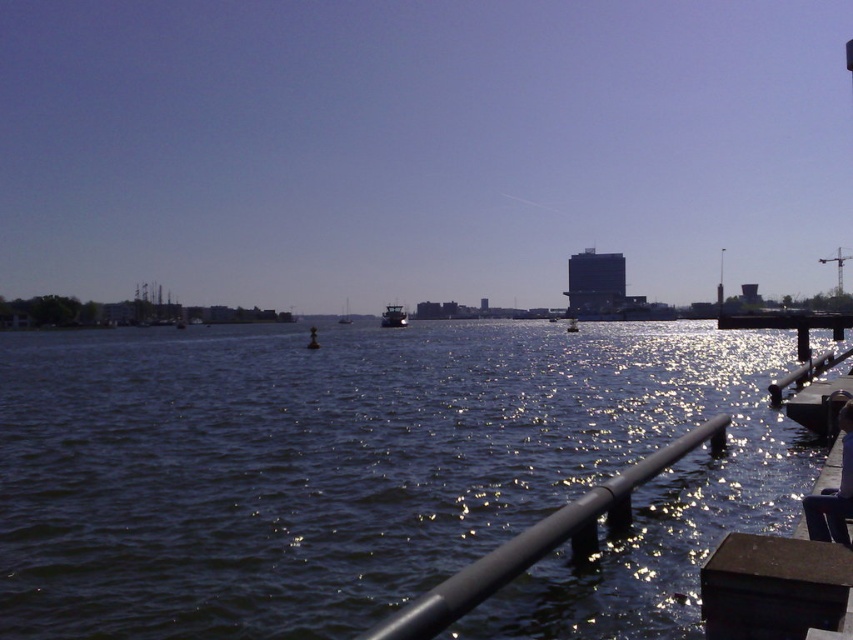
Question: Which of these objects is positioned closest to the black metal rail at lower center?

Choices:
 (A) metallic gray boat at center
 (B) white glossy sailboat at center
 (C) dark blue water at center

Answer: (C)

Question: Is dark blue water at center smaller than metallic silver boat at center?

Choices:
 (A) yes
 (B) no

Answer: (B)

Question: Is metallic gray railing at lower right in front of metallic silver boat at center?

Choices:
 (A) no
 (B) yes

Answer: (B)

Question: Does white glossy sailboat at center come in front of metallic silver boat at center?

Choices:
 (A) no
 (B) yes

Answer: (A)

Question: Which object appears closest to the camera in this image?

Choices:
 (A) metallic gray boat at center
 (B) dark blue water at center
 (C) metallic silver boat at center

Answer: (B)

Question: Among these objects, which one is farthest from the camera?

Choices:
 (A) metallic gray railing at lower right
 (B) white glossy sailboat at center

Answer: (B)